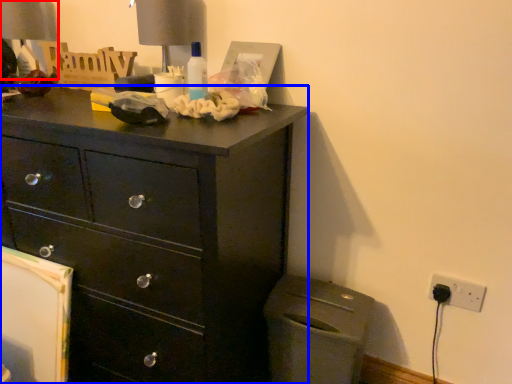
Question: Which object is closer to the camera taking this photo, table lamp (highlighted by a red box) or chest of drawers (highlighted by a blue box)?

Choices:
 (A) table lamp
 (B) chest of drawers

Answer: (B)